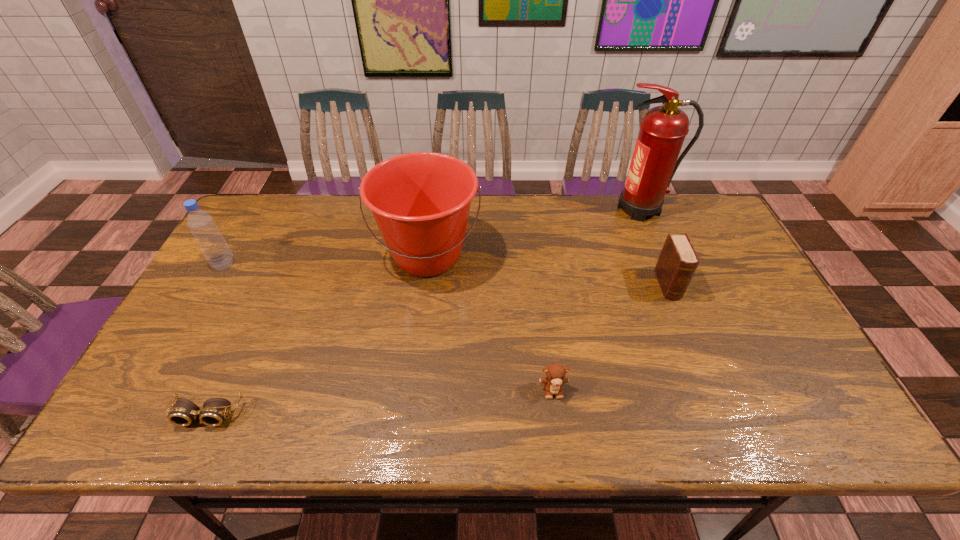
In the image, there is a desktop. Identify the location of vacant space at the near right corner. (800, 403).

At what (x,y) coordinates should I click in order to perform the action: click on free space that is in between the tallest object and the third object from right to left. Please return your answer as a coordinate pair (x, y). This screenshot has height=540, width=960. Looking at the image, I should click on (597, 299).

At what (x,y) coordinates should I click in order to perform the action: click on free area in between the teddy bear and the bottle. Please return your answer as a coordinate pair (x, y). This screenshot has width=960, height=540. Looking at the image, I should click on (389, 327).

Where is `free space between the fire extinguisher and the bucket`? The height and width of the screenshot is (540, 960). free space between the fire extinguisher and the bucket is located at coordinates (535, 232).

The height and width of the screenshot is (540, 960). I want to click on free space between the fourth tallest object and the fourth shortest object, so click(446, 275).

Identify the location of vacant area that lies between the bucket and the diary. (548, 271).

The height and width of the screenshot is (540, 960). Identify the location of free space between the farthest object and the shortest object. (424, 312).

You are a GUI agent. You are given a task and a screenshot of the screen. Output one action in this format:
    pyautogui.click(x=<x>, y=<y>)
    Task: Click on the vacant region between the fifth object from right to left and the bucket
    The image size is (960, 540).
    Given the screenshot: What is the action you would take?
    pyautogui.click(x=318, y=335)

Locate an element on the screen. free space between the third object from left to right and the shortest object is located at coordinates (318, 335).

At what (x,y) coordinates should I click in order to perform the action: click on empty location between the fourth tallest object and the third object from left to right. Please return your answer as a coordinate pair (x, y). This screenshot has height=540, width=960. Looking at the image, I should click on (548, 271).